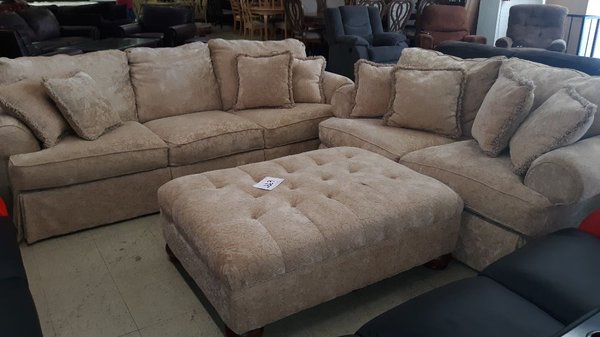
You are a GUI agent. You are given a task and a screenshot of the screen. Output one action in this format:
    pyautogui.click(x=<x>, y=<y>)
    Task: Click on the ottoman
    The height and width of the screenshot is (337, 600).
    Given the screenshot: What is the action you would take?
    pyautogui.click(x=361, y=218)